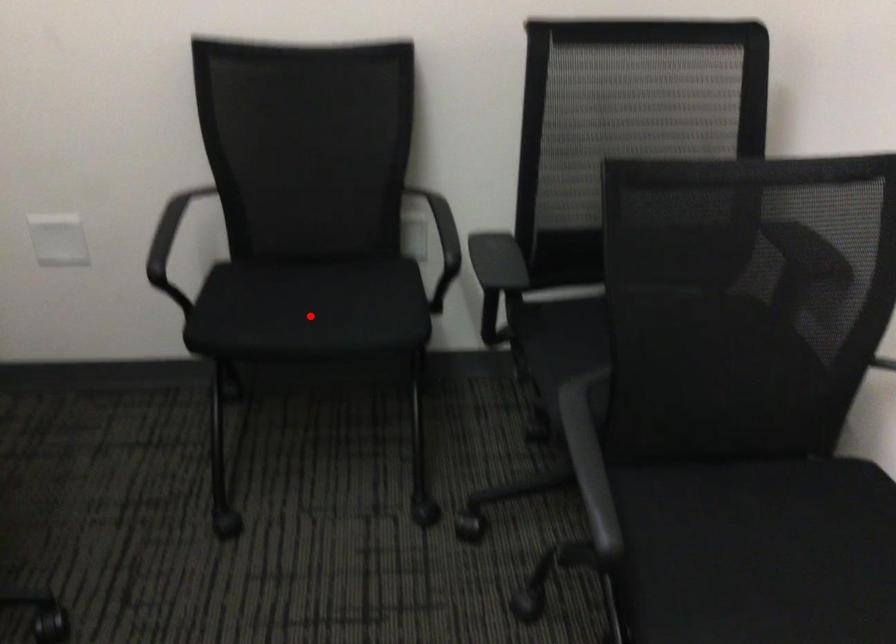
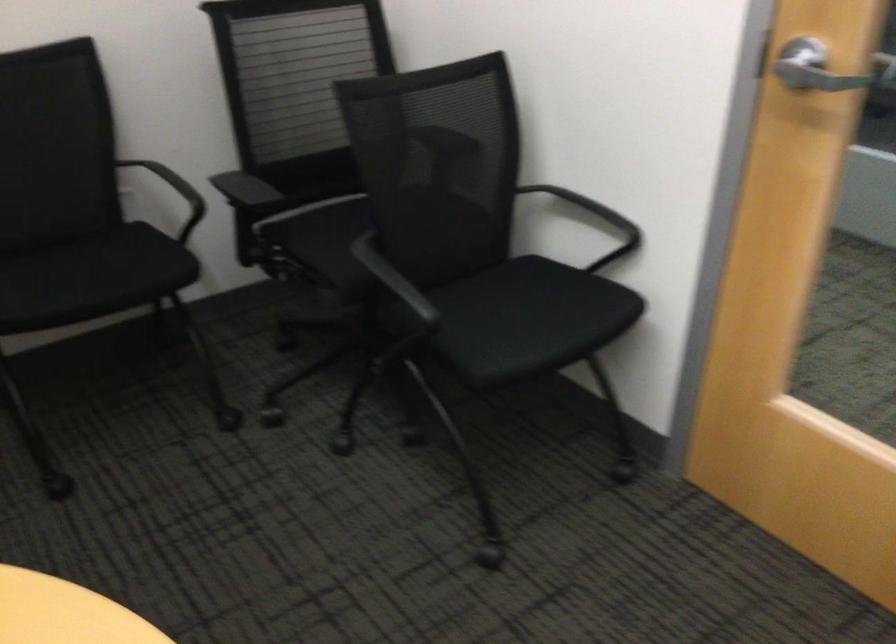
Question: I am providing you with two images of the same scene from different viewpoints. A red point is marked on the first image. Is the red point's position out of view in image 2?

Choices:
 (A) Yes
 (B) No

Answer: (B)